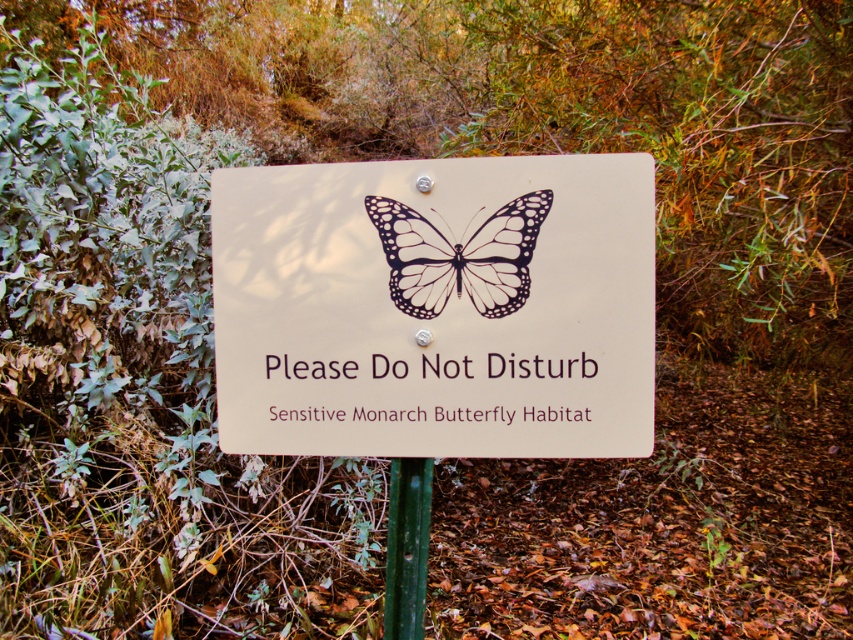
Question: Is beige plastic sign at center wider than black matte butterfly at center?

Choices:
 (A) no
 (B) yes

Answer: (B)

Question: Which of the following is the closest to the observer?

Choices:
 (A) (549, 408)
 (B) (537, 196)

Answer: (B)

Question: Can you confirm if beige plastic sign at center is smaller than green metallic pole at center?

Choices:
 (A) yes
 (B) no

Answer: (B)

Question: Estimate the real-world distances between objects in this image. Which object is closer to the green metallic pole at center?

Choices:
 (A) black matte butterfly at center
 (B) beige plastic sign at center

Answer: (B)

Question: Which point is farther to the camera?

Choices:
 (A) (498, 256)
 (B) (247, 168)
 (C) (407, 472)

Answer: (C)

Question: Is beige plastic sign at center to the right of black matte butterfly at center from the viewer's perspective?

Choices:
 (A) no
 (B) yes

Answer: (A)